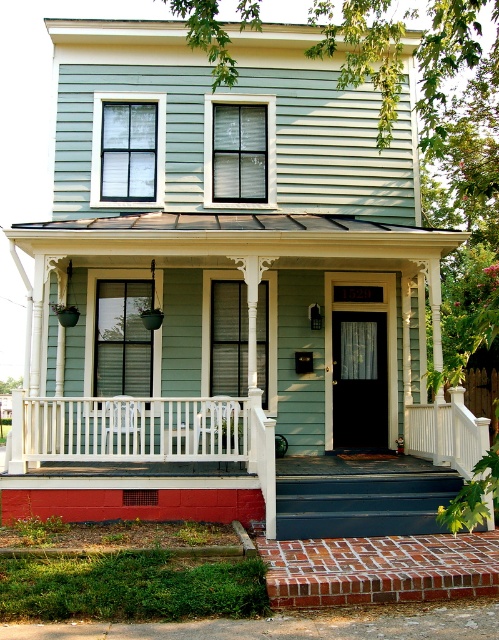
Question: Which object is closer to the camera taking this photo?

Choices:
 (A) white painted wood porch at center
 (B) smooth white railing at center
 (C) white painted wood railing at center

Answer: (B)

Question: Estimate the real-world distances between objects in this image. Which object is farther from the white painted wood railing at center?

Choices:
 (A) white painted wood porch at center
 (B) smooth white railing at center

Answer: (A)

Question: Which is nearer to the white painted wood porch at center?

Choices:
 (A) smooth white railing at center
 (B) white painted wood railing at center

Answer: (B)

Question: Does white painted wood porch at center have a lesser width compared to smooth white railing at center?

Choices:
 (A) no
 (B) yes

Answer: (B)

Question: Can you confirm if white painted wood porch at center is positioned above white painted wood railing at center?

Choices:
 (A) no
 (B) yes

Answer: (A)

Question: Can you confirm if white painted wood porch at center is smaller than smooth white railing at center?

Choices:
 (A) no
 (B) yes

Answer: (B)